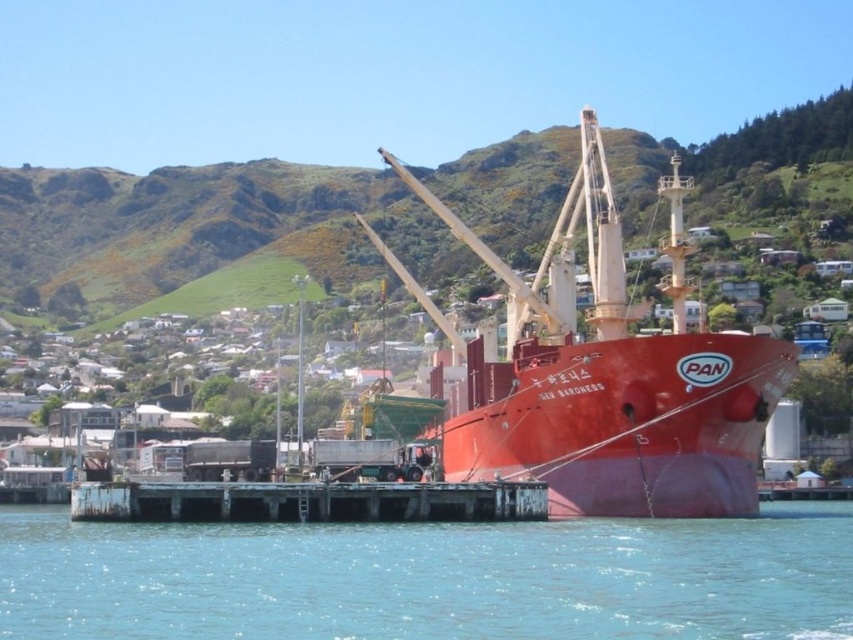
Question: Which object appears farthest from the camera in this image?

Choices:
 (A) green grassy hillside at upper center
 (B) clear blue water at lower center
 (C) matte red ship at center

Answer: (A)

Question: Which point is closer to the camera?

Choices:
 (A) (96, 508)
 (B) (27, 624)
 (C) (525, 394)
 (D) (694, 156)

Answer: (B)

Question: Is clear blue water at lower center wider than rusty metal dock at lower center?

Choices:
 (A) yes
 (B) no

Answer: (A)

Question: Is clear blue water at lower center smaller than rusty metal dock at lower center?

Choices:
 (A) yes
 (B) no

Answer: (B)

Question: Which point is closer to the camera?

Choices:
 (A) (492, 516)
 (B) (474, 604)

Answer: (B)

Question: Is clear blue water at lower center closer to camera compared to rusty metal dock at lower center?

Choices:
 (A) yes
 (B) no

Answer: (A)